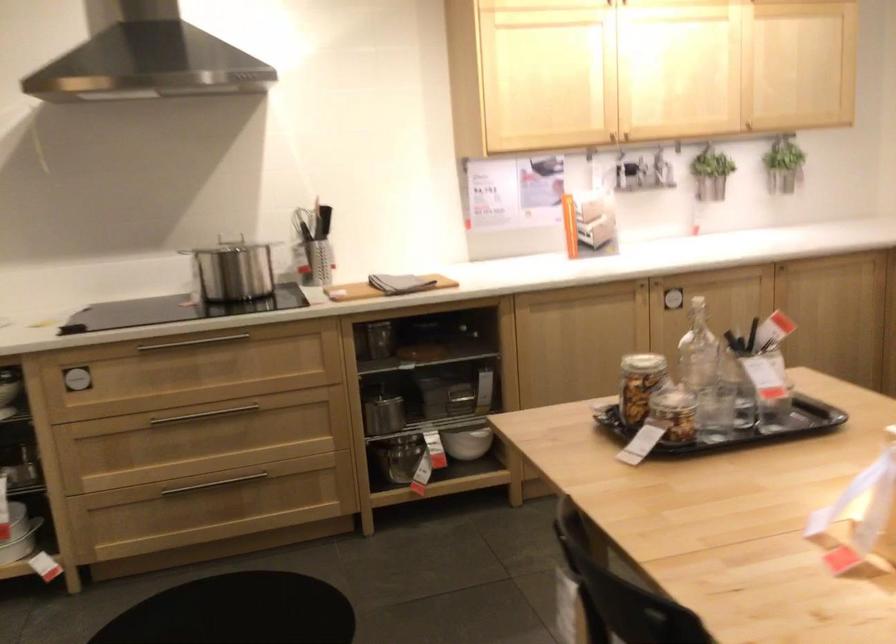
The location [467,442] corresponds to which object?

It corresponds to the metal bowl in the image.